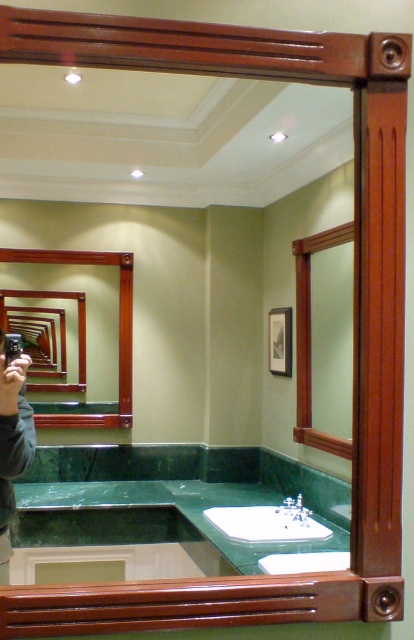
You are standing in the bathroom and want to adjust the mirror. Since the green marble mirror at center and the white glossy sink at center are both at the center, which one is closer to you?

The green marble mirror at center is closer to you because it is in front of the white glossy sink at center.

You are designing a bathroom layout and need to ensure that the green marble mirror at center and the white glossy sink at center are placed so that the mirror is above the sink. Given their heights, can the mirror be positioned directly above the sink without overlapping the sink?

The green marble mirror at center has a greater height compared to the white glossy sink at center. Since the mirror is taller, it can be positioned above the sink without overlapping as long as there is sufficient vertical space between them.